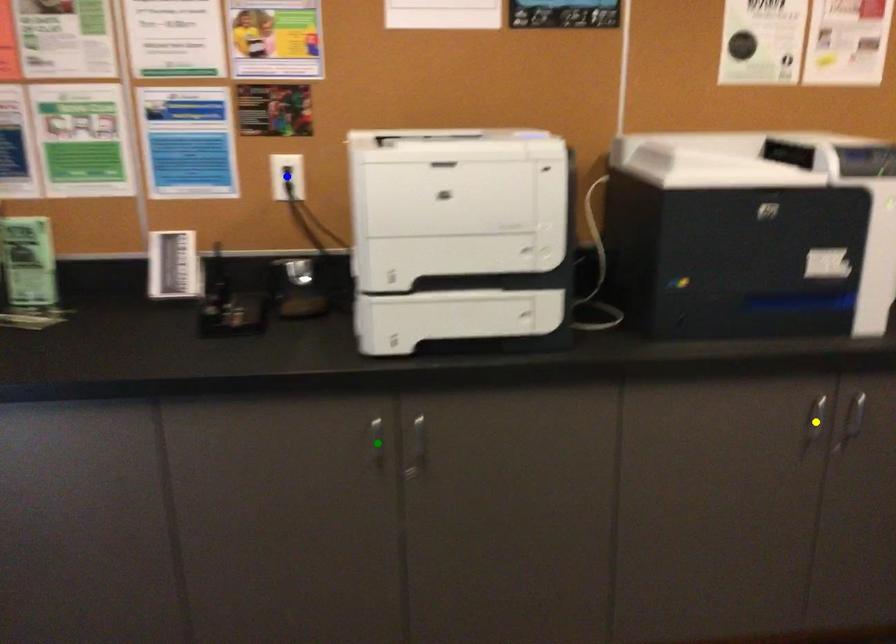
Consider the image. Order these from nearest to farthest:
- yellow point
- blue point
- green point

blue point, yellow point, green point